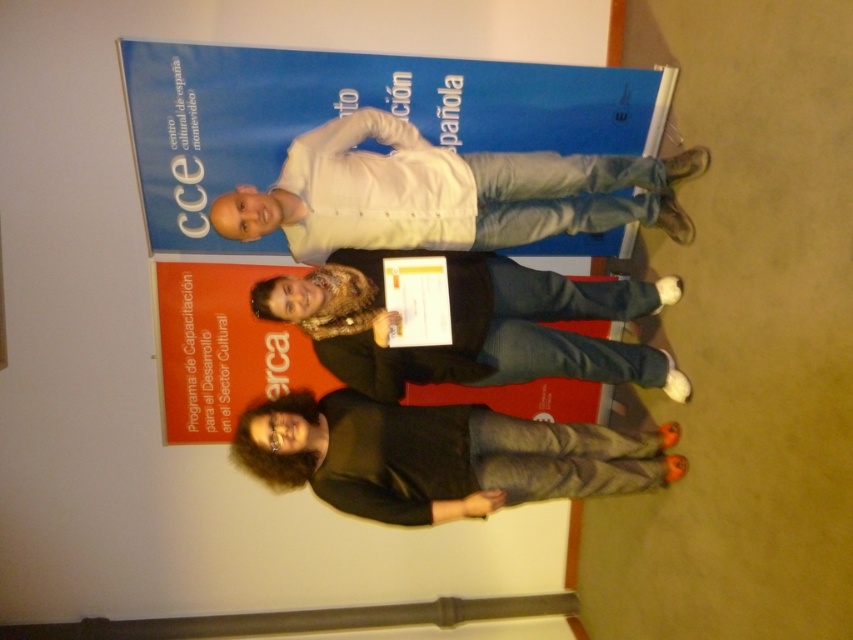
You are standing in front of the backdrop and want to ensure that the white matte shirt at center is visible in the photo. Based on its position, is it likely centered horizontally within the image?

The white matte shirt at center is located at point coordinates that might not necessarily indicate exact centering without additional context about the image dimensions. However, its label explicitly states it is at the center, so yes, it is likely centered horizontally.

You are organizing a photo shoot and need to ensure that all participants are visible in the frame. The camera you are using has a focus range that can only accommodate objects up to a certain size. Given that the white matte shirt at center is larger than the black matte shirt at lower center, which participant should you prioritize focusing on to ensure clarity?

You should prioritize focusing on the white matte shirt at center because it has a larger size compared to the black matte shirt at lower center, making it more likely to be within the camera focus range for clarity.

You are standing in front of the backdrop and want to place a small sticker on the point that is closer to you. Which point should you choose between point (x=451, y=490) and point (x=254, y=294)?

Point (x=254, y=294) is closer to you, so you should place the sticker there.